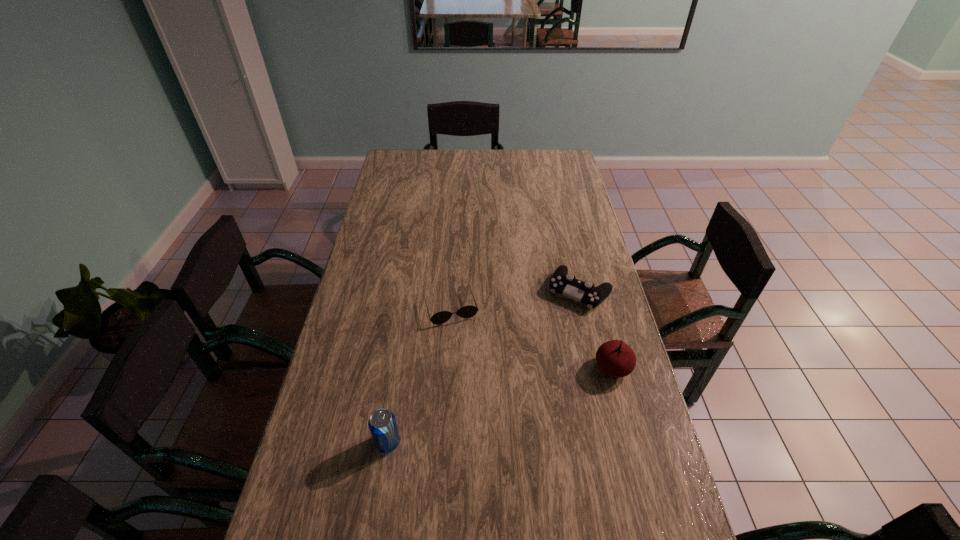
The width and height of the screenshot is (960, 540). Find the location of `free space on the desktop that is between the beer can and the second tallest object and is positioned on the front-facing side of the sunglasses`. free space on the desktop that is between the beer can and the second tallest object and is positioned on the front-facing side of the sunglasses is located at coordinates (481, 411).

Locate an element on the screen. This screenshot has width=960, height=540. vacant spot on the desktop that is between the leftmost object and the third farthest object and is positioned on the surface of the control is located at coordinates (506, 403).